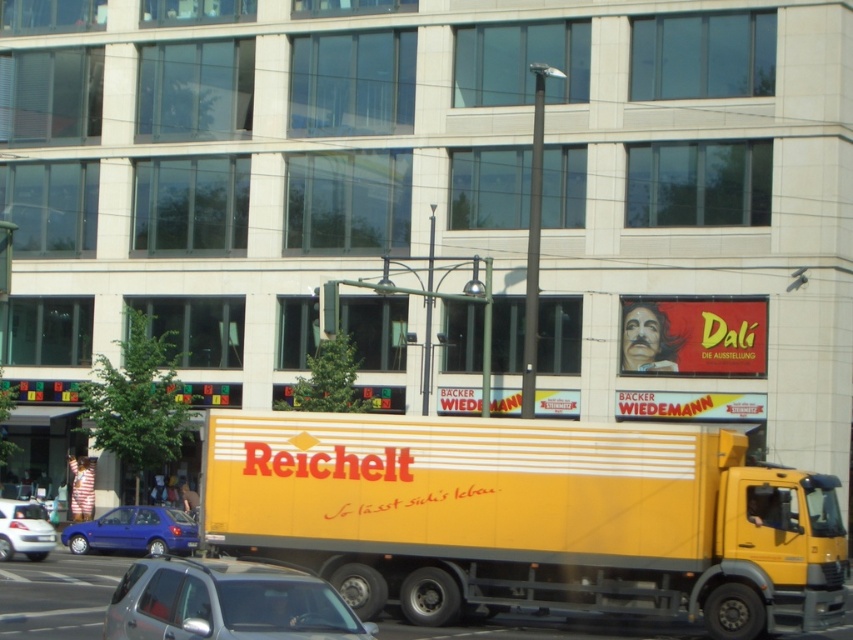
Question: Considering the real-world distances, which object is closest to the white glossy car at lower left?

Choices:
 (A) metallic blue hatchback at lower left
 (B) silver metallic car at lower left

Answer: (A)

Question: Is metallic blue hatchback at lower left above white glossy car at lower left?

Choices:
 (A) no
 (B) yes

Answer: (A)

Question: Estimate the real-world distances between objects in this image. Which object is closer to the silver metallic car at lower left?

Choices:
 (A) metallic blue hatchback at lower left
 (B) yellow matte truck at center
 (C) white glossy car at lower left

Answer: (B)

Question: Is the position of silver metallic car at lower left more distant than that of metallic blue hatchback at lower left?

Choices:
 (A) yes
 (B) no

Answer: (B)

Question: Is metallic blue hatchback at lower left further to the viewer compared to white glossy car at lower left?

Choices:
 (A) no
 (B) yes

Answer: (B)

Question: Among these points, which one is farthest from the camera?

Choices:
 (A) (138, 596)
 (B) (22, 532)
 (C) (77, 541)

Answer: (C)